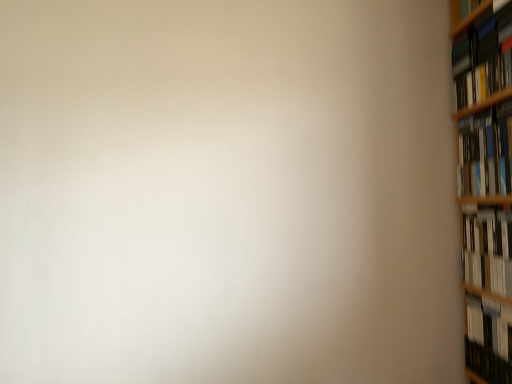
What do you see at coordinates (487, 248) in the screenshot? I see `white glossy book at right, acting as the 3th book starting from the top` at bounding box center [487, 248].

Describe the element at coordinates (483, 58) in the screenshot. I see `hardcover book at upper right, the fourth book in the bottom-to-top sequence` at that location.

The height and width of the screenshot is (384, 512). In order to click on hardcover book at right, which appears as the 1th book when ordered from the bottom in this screenshot , I will do `click(487, 344)`.

From a real-world perspective, is hardcover book at right, the third book positioned from the bottom, above or below hardcover book at right, which appears as the 1th book when ordered from the bottom?

hardcover book at right, the third book positioned from the bottom, is situated higher than hardcover book at right, which appears as the 1th book when ordered from the bottom, in the real world.

Looking at this image, can you confirm if hardcover book at right, the third book positioned from the bottom, is smaller than hardcover book at right, which appears as the 1th book when ordered from the bottom?

Incorrect, hardcover book at right, the third book positioned from the bottom, is not smaller in size than hardcover book at right, which appears as the 1th book when ordered from the bottom.

Is hardcover book at right, the 2th book when ordered from top to bottom, next to hardcover book at right, which appears as the 1th book when ordered from the bottom?

No, hardcover book at right, the 2th book when ordered from top to bottom, is not making contact with hardcover book at right, which appears as the 1th book when ordered from the bottom.

In the image, is hardcover book at right, the third book positioned from the bottom, on the left side or the right side of hardcover book at right, which appears as the 1th book when ordered from the bottom?

hardcover book at right, the third book positioned from the bottom, is positioned on hardcover book at right, which appears as the 1th book when ordered from the bottom,'s left side.

Considering the relative sizes of hardcover book at upper right, the fourth book in the bottom-to-top sequence, and hardcover book at right, which appears as the 1th book when ordered from the bottom, in the image provided, is hardcover book at upper right, the fourth book in the bottom-to-top sequence, smaller than hardcover book at right, which appears as the 1th book when ordered from the bottom,?

No, hardcover book at upper right, the fourth book in the bottom-to-top sequence, is not smaller than hardcover book at right, which appears as the 1th book when ordered from the bottom.

From the image's perspective, who appears lower, hardcover book at upper right, marked as the first book in a top-to-bottom arrangement, or hardcover book at right, which appears as the 1th book when ordered from the bottom?

hardcover book at right, which appears as the 1th book when ordered from the bottom.

Is hardcover book at upper right, marked as the first book in a top-to-bottom arrangement, touching hardcover book at right, which appears as the 1th book when ordered from the bottom?

No, hardcover book at upper right, marked as the first book in a top-to-bottom arrangement, is not making contact with hardcover book at right, which appears as the 1th book when ordered from the bottom.

Which object is positioned more to the left, hardcover book at upper right, the fourth book in the bottom-to-top sequence, or white glossy book at right, positioned as the second book in bottom-to-top order?

hardcover book at upper right, the fourth book in the bottom-to-top sequence.

Is hardcover book at upper right, the fourth book in the bottom-to-top sequence, not within white glossy book at right, positioned as the second book in bottom-to-top order?

hardcover book at upper right, the fourth book in the bottom-to-top sequence, is positioned outside white glossy book at right, positioned as the second book in bottom-to-top order.

Does hardcover book at upper right, the fourth book in the bottom-to-top sequence, come in front of white glossy book at right, positioned as the second book in bottom-to-top order?

Yes, the depth of hardcover book at upper right, the fourth book in the bottom-to-top sequence, is less than that of white glossy book at right, positioned as the second book in bottom-to-top order.

From a real-world perspective, relative to white glossy book at right, positioned as the second book in bottom-to-top order, is hardcover book at upper right, the fourth book in the bottom-to-top sequence, vertically above or below?

hardcover book at upper right, the fourth book in the bottom-to-top sequence, is situated higher than white glossy book at right, positioned as the second book in bottom-to-top order, in the real world.

Does hardcover book at right, the fourth book from the top, have a smaller size compared to hardcover book at upper right, marked as the first book in a top-to-bottom arrangement?

Yes.

Is hardcover book at right, which appears as the 1th book when ordered from the bottom, not inside hardcover book at upper right, marked as the first book in a top-to-bottom arrangement?

Yes, hardcover book at right, which appears as the 1th book when ordered from the bottom, is not within hardcover book at upper right, marked as the first book in a top-to-bottom arrangement.

Considering the sizes of objects hardcover book at right, the fourth book from the top, and hardcover book at upper right, the fourth book in the bottom-to-top sequence, in the image provided, who is thinner, hardcover book at right, the fourth book from the top, or hardcover book at upper right, the fourth book in the bottom-to-top sequence,?

With smaller width is hardcover book at right, the fourth book from the top.

Which is nearer, (475, 332) or (471, 49)?

The point (475, 332) is closer.

Is hardcover book at right, the fourth book from the top, in contact with hardcover book at right, the third book positioned from the bottom?

There is a gap between hardcover book at right, the fourth book from the top, and hardcover book at right, the third book positioned from the bottom.

Considering the sizes of objects hardcover book at right, which appears as the 1th book when ordered from the bottom, and hardcover book at right, the third book positioned from the bottom, in the image provided, who is smaller, hardcover book at right, which appears as the 1th book when ordered from the bottom, or hardcover book at right, the third book positioned from the bottom,?

hardcover book at right, which appears as the 1th book when ordered from the bottom, is smaller.

From the image's perspective, between hardcover book at right, which appears as the 1th book when ordered from the bottom, and hardcover book at right, the third book positioned from the bottom, who is located below?

hardcover book at right, which appears as the 1th book when ordered from the bottom.

Is hardcover book at right, which appears as the 1th book when ordered from the bottom, located outside hardcover book at right, the 2th book when ordered from top to bottom?

Absolutely, hardcover book at right, which appears as the 1th book when ordered from the bottom, is external to hardcover book at right, the 2th book when ordered from top to bottom.

Considering the relative sizes of white glossy book at right, positioned as the second book in bottom-to-top order, and hardcover book at upper right, the fourth book in the bottom-to-top sequence, in the image provided, is white glossy book at right, positioned as the second book in bottom-to-top order, bigger than hardcover book at upper right, the fourth book in the bottom-to-top sequence,?

No, white glossy book at right, positioned as the second book in bottom-to-top order, is not bigger than hardcover book at upper right, the fourth book in the bottom-to-top sequence.

From a real-world perspective, who is located lower, white glossy book at right, positioned as the second book in bottom-to-top order, or hardcover book at upper right, the fourth book in the bottom-to-top sequence?

From a 3D spatial view, white glossy book at right, positioned as the second book in bottom-to-top order, is below.

How different are the orientations of white glossy book at right, positioned as the second book in bottom-to-top order, and hardcover book at upper right, marked as the first book in a top-to-bottom arrangement, in degrees?

white glossy book at right, positioned as the second book in bottom-to-top order, and hardcover book at upper right, marked as the first book in a top-to-bottom arrangement, are facing 0.000767 degrees away from each other.

Is white glossy book at right, acting as the 3th book starting from the top, facing away from hardcover book at upper right, the fourth book in the bottom-to-top sequence?

No, hardcover book at upper right, the fourth book in the bottom-to-top sequence, is not at the back of white glossy book at right, acting as the 3th book starting from the top.

This screenshot has width=512, height=384. Find the location of `book that is the 1st one when counting leftward from the white glossy book at right, acting as the 3th book starting from the top`. book that is the 1st one when counting leftward from the white glossy book at right, acting as the 3th book starting from the top is located at coordinates (486, 153).

Can you tell me how much hardcover book at right, the third book positioned from the bottom, and white glossy book at right, positioned as the second book in bottom-to-top order, differ in facing direction?

hardcover book at right, the third book positioned from the bottom, and white glossy book at right, positioned as the second book in bottom-to-top order, are facing 0.00561 degrees away from each other.

From the image's perspective, does hardcover book at right, the 2th book when ordered from top to bottom, appear lower than white glossy book at right, acting as the 3th book starting from the top?

No, from the image's perspective, hardcover book at right, the 2th book when ordered from top to bottom, is not beneath white glossy book at right, acting as the 3th book starting from the top.

I want to click on the 2nd book counting from the left side of the hardcover book at right, the fourth book from the top, so click(x=486, y=153).

Which book is the 3rd one when counting from the front of the hardcover book at right, which appears as the 1th book when ordered from the bottom? Please provide its 2D coordinates.

[(483, 58)]

Considering their positions, is hardcover book at right, the third book positioned from the bottom, positioned closer to hardcover book at right, the fourth book from the top, than hardcover book at upper right, the fourth book in the bottom-to-top sequence?

Based on the image, hardcover book at right, the third book positioned from the bottom, appears to be nearer to hardcover book at right, the fourth book from the top.

Looking at the image, which one is located further to hardcover book at right, the third book positioned from the bottom, white glossy book at right, acting as the 3th book starting from the top, or hardcover book at upper right, marked as the first book in a top-to-bottom arrangement?

The object further to hardcover book at right, the third book positioned from the bottom, is white glossy book at right, acting as the 3th book starting from the top.

Considering their positions, is hardcover book at upper right, marked as the first book in a top-to-bottom arrangement, positioned further to hardcover book at right, the fourth book from the top, than white glossy book at right, acting as the 3th book starting from the top?

hardcover book at upper right, marked as the first book in a top-to-bottom arrangement.

When comparing their distances from hardcover book at upper right, marked as the first book in a top-to-bottom arrangement, does hardcover book at right, the third book positioned from the bottom, or hardcover book at right, the fourth book from the top, seem further?

The object further to hardcover book at upper right, marked as the first book in a top-to-bottom arrangement, is hardcover book at right, the fourth book from the top.

Consider the image. Estimate the real-world distances between objects in this image. Which object is closer to hardcover book at right, the 2th book when ordered from top to bottom, hardcover book at right, the fourth book from the top, or white glossy book at right, positioned as the second book in bottom-to-top order?

white glossy book at right, positioned as the second book in bottom-to-top order, is closer to hardcover book at right, the 2th book when ordered from top to bottom.

From the image, which object appears to be nearer to hardcover book at upper right, marked as the first book in a top-to-bottom arrangement, hardcover book at right, which appears as the 1th book when ordered from the bottom, or hardcover book at right, the third book positioned from the bottom?

hardcover book at right, the third book positioned from the bottom.

Estimate the real-world distances between objects in this image. Which object is further from white glossy book at right, acting as the 3th book starting from the top, hardcover book at right, the third book positioned from the bottom, or hardcover book at upper right, the fourth book in the bottom-to-top sequence?

Among the two, hardcover book at upper right, the fourth book in the bottom-to-top sequence, is located further to white glossy book at right, acting as the 3th book starting from the top.

Based on their spatial positions, is white glossy book at right, positioned as the second book in bottom-to-top order, or hardcover book at right, the third book positioned from the bottom, closer to hardcover book at right, which appears as the 1th book when ordered from the bottom?

white glossy book at right, positioned as the second book in bottom-to-top order, is closer to hardcover book at right, which appears as the 1th book when ordered from the bottom.

The image size is (512, 384). Identify the location of book that lies between hardcover book at upper right, the fourth book in the bottom-to-top sequence, and white glossy book at right, acting as the 3th book starting from the top, from top to bottom. (486, 153).

You are a GUI agent. You are given a task and a screenshot of the screen. Output one action in this format:
    pyautogui.click(x=<x>, y=<y>)
    Task: Click on the book that lies between hardcover book at right, the 2th book when ordered from top to bottom, and hardcover book at right, the fourth book from the top, from top to bottom
    The image size is (512, 384).
    Given the screenshot: What is the action you would take?
    pyautogui.click(x=487, y=248)